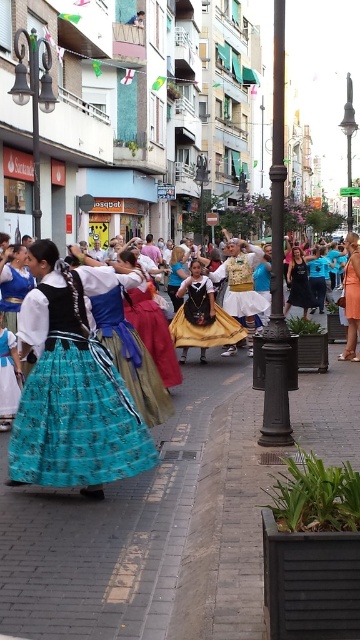
You are a photographer standing at the camera position. You want to capture a closeup shot of the turquoise fabric skirt at lower left. Given that your camera can focus on objects within 5 meters, will you be able to take the closeup?

The turquoise fabric skirt at lower left is 5.66 meters from camera, which is beyond the camera focus range of 5 meters. Therefore, you cannot take the closeup.